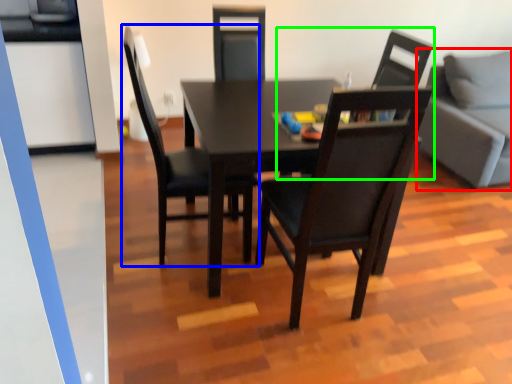
Question: Estimate the real-world distances between objects in this image. Which object is closer to studio couch (highlighted by a red box), chair (highlighted by a blue box) or chair (highlighted by a green box)?

Choices:
 (A) chair
 (B) chair

Answer: (B)